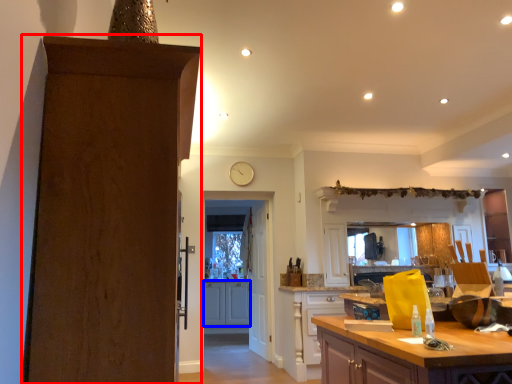
Question: Among these objects, which one is farthest to the camera, door (highlighted by a red box) or cabinetry (highlighted by a blue box)?

Choices:
 (A) door
 (B) cabinetry

Answer: (B)